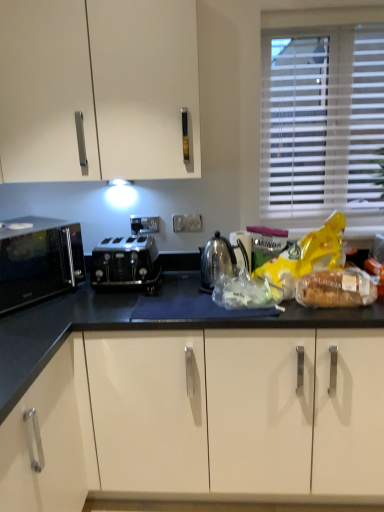
Question: From a real-world perspective, is brown textured bread at right, marked as the 1th food in a right-to-left arrangement, physically above black matte microwave at left?

Choices:
 (A) yes
 (B) no

Answer: (A)

Question: Considering the relative sizes of brown textured bread at right, marked as the 1th food in a right-to-left arrangement, and black matte microwave at left in the image provided, is brown textured bread at right, marked as the 1th food in a right-to-left arrangement, bigger than black matte microwave at left?

Choices:
 (A) no
 (B) yes

Answer: (B)

Question: Is brown textured bread at right, marked as the 1th food in a right-to-left arrangement, turned away from black matte microwave at left?

Choices:
 (A) no
 (B) yes

Answer: (A)

Question: Would you consider brown textured bread at right, which appears as the second food when viewed from the left, to be distant from black matte microwave at left?

Choices:
 (A) yes
 (B) no

Answer: (B)

Question: Does brown textured bread at right, which appears as the second food when viewed from the left, have a smaller size compared to black matte microwave at left?

Choices:
 (A) no
 (B) yes

Answer: (A)

Question: Is black matte microwave at left taller or shorter than translucent plastic bag at center, which is counted as the second food, starting from the right?

Choices:
 (A) tall
 (B) short

Answer: (A)

Question: From the image's perspective, relative to translucent plastic bag at center, placed as the first food when sorted from left to right, is black matte microwave at left above or below?

Choices:
 (A) below
 (B) above

Answer: (B)

Question: In terms of width, does black matte microwave at left look wider or thinner when compared to translucent plastic bag at center, which is counted as the second food, starting from the right?

Choices:
 (A) wide
 (B) thin

Answer: (A)

Question: Is point (56, 261) closer or farther from the camera than point (249, 298)?

Choices:
 (A) farther
 (B) closer

Answer: (A)

Question: Relative to brown textured bread at right, which appears as the second food when viewed from the left, is black matte microwave at left in front or behind?

Choices:
 (A) front
 (B) behind

Answer: (A)

Question: From a real-world perspective, is black matte microwave at left above or below brown textured bread at right, marked as the 1th food in a right-to-left arrangement?

Choices:
 (A) below
 (B) above

Answer: (A)

Question: Based on their sizes in the image, would you say black matte microwave at left is bigger or smaller than brown textured bread at right, marked as the 1th food in a right-to-left arrangement?

Choices:
 (A) big
 (B) small

Answer: (B)

Question: Do you think black matte microwave at left is within brown textured bread at right, marked as the 1th food in a right-to-left arrangement, or outside of it?

Choices:
 (A) inside
 (B) outside

Answer: (B)

Question: In the image, is clear plastic bread at right positioned in front of or behind satin silver toaster at center?

Choices:
 (A) front
 (B) behind

Answer: (A)

Question: Considering the positions of clear plastic bread at right and satin silver toaster at center in the image, is clear plastic bread at right taller or shorter than satin silver toaster at center?

Choices:
 (A) tall
 (B) short

Answer: (B)